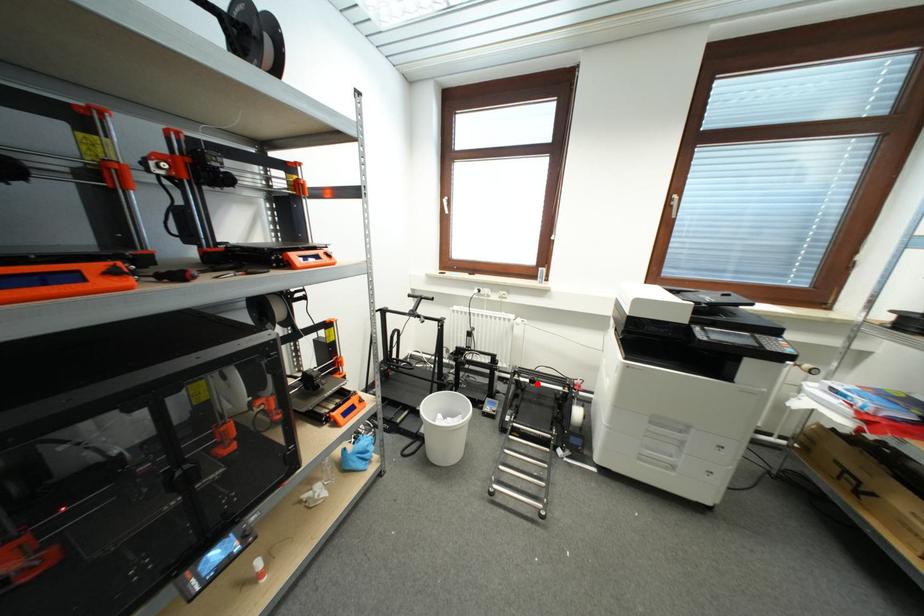
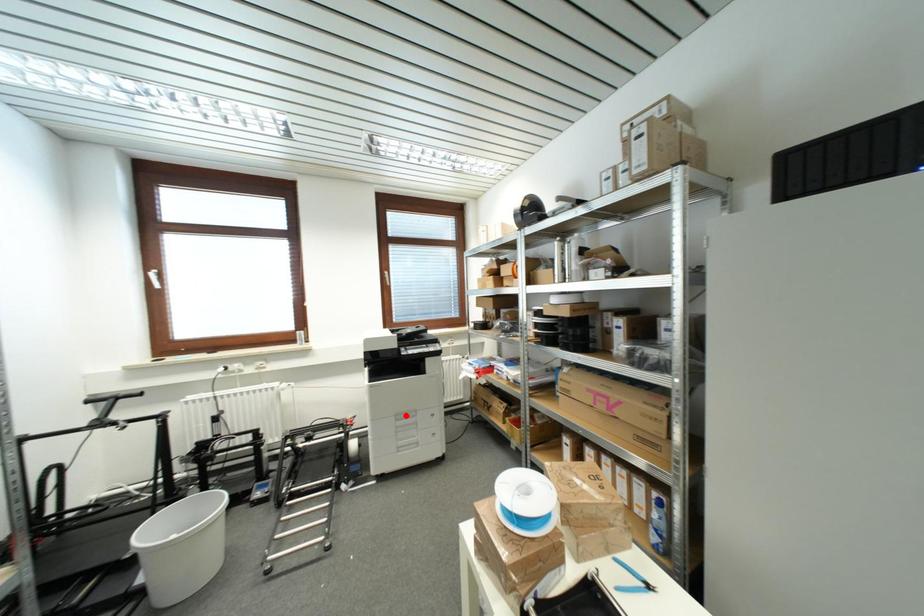
I am providing you with two images of the same scene from different viewpoints. A red point is marked on the first image and another point is marked on the second image. Is the red point in image1 aligned with the point shown in image2?

No